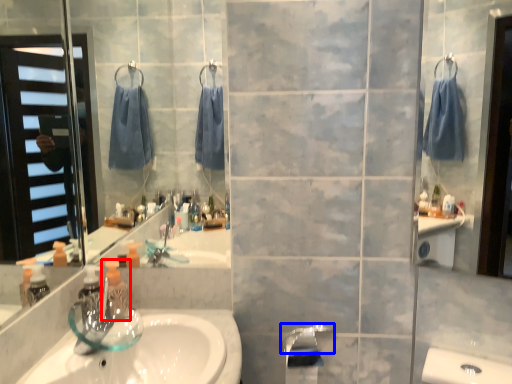
Question: Which of the following is the farthest to the observer, soap dispenser (highlighted by a red box) or faucet (highlighted by a blue box)?

Choices:
 (A) soap dispenser
 (B) faucet

Answer: (B)